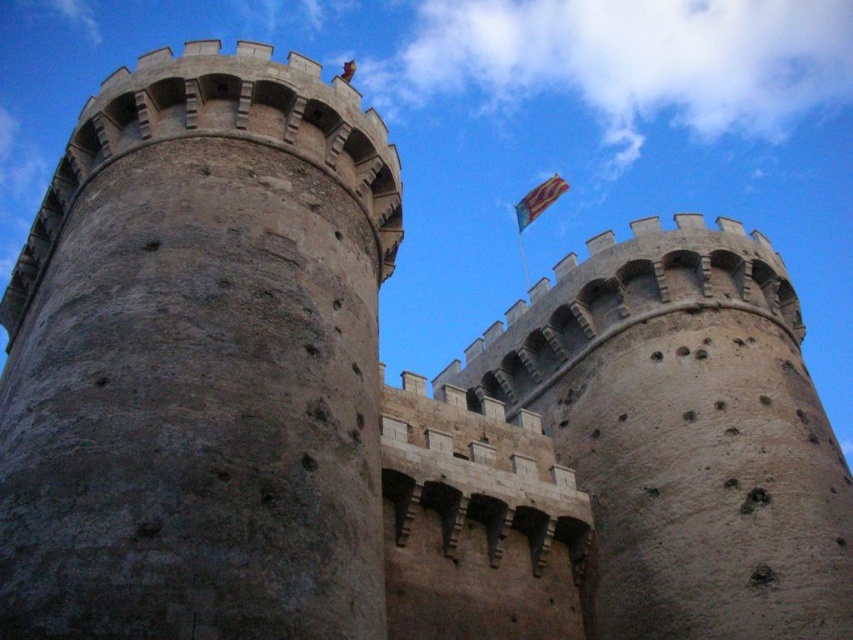
Consider the image. Can you confirm if rustic stone tower at upper center is taller than yellow-orange fabric flag at upper center?

No, rustic stone tower at upper center is not taller than yellow-orange fabric flag at upper center.

Which is in front, point (795, 301) or point (532, 188)?

Point (795, 301) is in front.

Is point (602, 458) more distant than point (556, 173)?

That is False.

At what (x,y) coordinates should I click in order to perform the action: click on rustic stone tower at upper center. Please return your answer as a coordinate pair (x, y). Looking at the image, I should click on (683, 433).

Between point (189, 180) and point (790, 358), which one is positioned in front?

Positioned in front is point (189, 180).

Which is above, brown stone tower at left or rustic stone tower at upper center?

brown stone tower at left

Between point (97, 586) and point (737, 536), which one is positioned in front?

Point (97, 586)

The height and width of the screenshot is (640, 853). I want to click on brown stone tower at left, so click(200, 362).

Find the location of a particular element. brown stone tower at left is located at coordinates click(200, 362).

Which of these two, brown stone tower at left or yellow-orange fabric flag at upper center, stands shorter?

yellow-orange fabric flag at upper center is shorter.

Find the location of a particular element. The image size is (853, 640). brown stone tower at left is located at coordinates (200, 362).